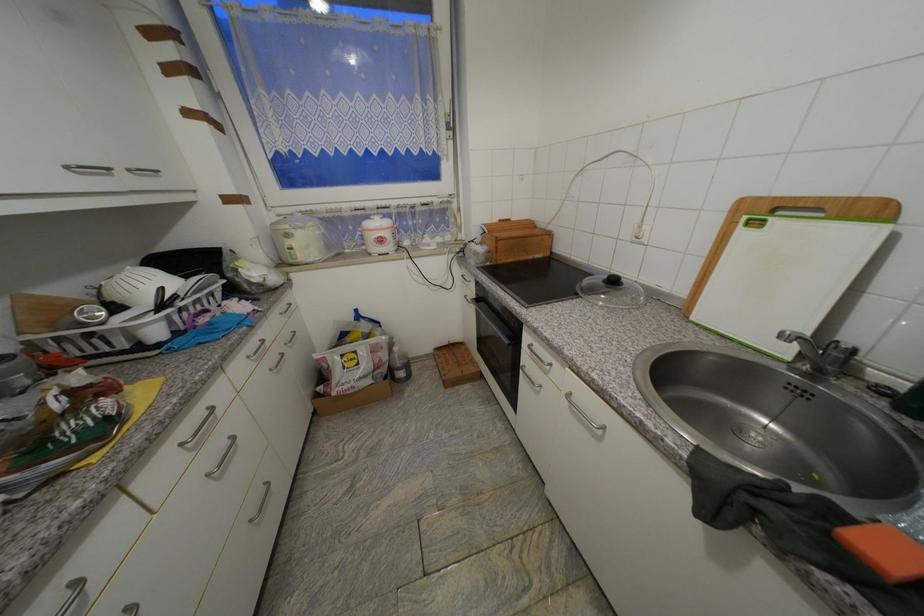
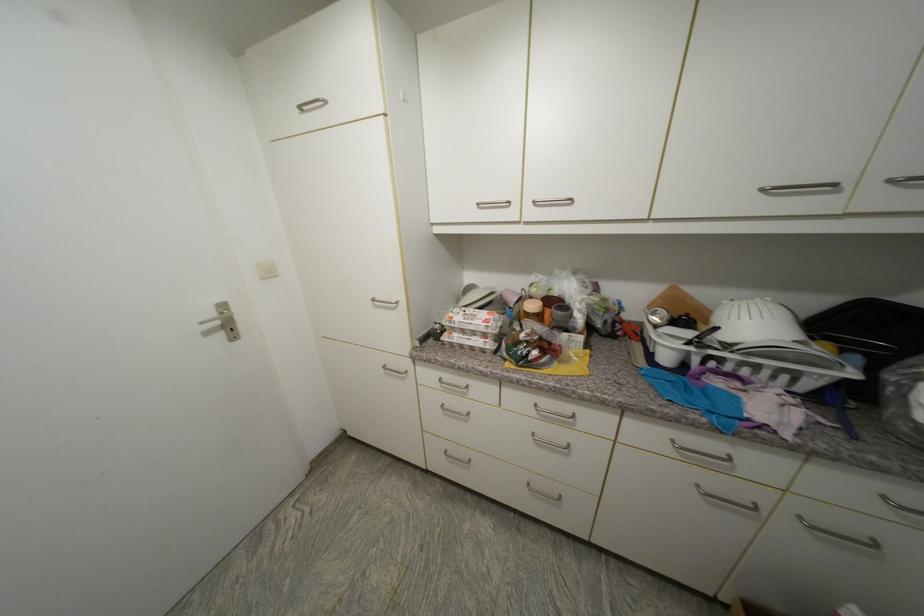
In the second image, find the point that corresponds to point (74, 169) in the first image.

(768, 191)